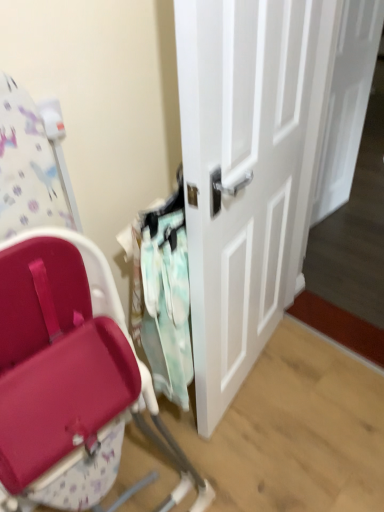
Where is `mint fabric laundry at center`? This screenshot has width=384, height=512. mint fabric laundry at center is located at coordinates (162, 294).

Where is `mint fabric laundry at center`? This screenshot has width=384, height=512. mint fabric laundry at center is located at coordinates (162, 294).

Can you confirm if white glossy door at center, arranged as the first door when viewed from the front, is shorter than mint fabric laundry at center?

Incorrect, the height of white glossy door at center, arranged as the first door when viewed from the front, does not fall short of that of mint fabric laundry at center.

Which object is positioned more to the left, white glossy door at center, arranged as the first door when viewed from the front, or mint fabric laundry at center?

mint fabric laundry at center is more to the left.

Is mint fabric laundry at center inside white glossy door at center, which ranks as the second door in right-to-left order?

Actually, mint fabric laundry at center is outside white glossy door at center, which ranks as the second door in right-to-left order.

Looking at this image, from a real-world perspective, is white glossy door at center, the second door positioned from the back, positioned above or below mint fabric laundry at center?

white glossy door at center, the second door positioned from the back, is above mint fabric laundry at center.

Considering the relative sizes of white glossy door at center, the second door positioned from the back, and white glossy door at center, which is the 1th door in right-to-left order, in the image provided, is white glossy door at center, the second door positioned from the back, taller than white glossy door at center, which is the 1th door in right-to-left order,?

Indeed, white glossy door at center, the second door positioned from the back, has a greater height compared to white glossy door at center, which is the 1th door in right-to-left order.

Would you say white glossy door at center, the second door positioned from the back, is inside or outside white glossy door at center, arranged as the 1th door when viewed from the back?

white glossy door at center, the second door positioned from the back, lies outside white glossy door at center, arranged as the 1th door when viewed from the back.

Based on the photo, considering the relative positions of white glossy door at center, which ranks as the second door in right-to-left order, and white glossy door at center, arranged as the 1th door when viewed from the back, in the image provided, is white glossy door at center, which ranks as the second door in right-to-left order, to the left of white glossy door at center, arranged as the 1th door when viewed from the back, from the viewer's perspective?

Indeed, white glossy door at center, which ranks as the second door in right-to-left order, is positioned on the left side of white glossy door at center, arranged as the 1th door when viewed from the back.

The height and width of the screenshot is (512, 384). I want to click on door to the left of white glossy door at center, the second door positioned from the front, so click(244, 175).

Looking at this image, considering the sizes of objects white glossy door at center, arranged as the 1th door when viewed from the back, and mint fabric laundry at center in the image provided, who is thinner, white glossy door at center, arranged as the 1th door when viewed from the back, or mint fabric laundry at center?

Thinner between the two is white glossy door at center, arranged as the 1th door when viewed from the back.

Is mint fabric laundry at center at the back of white glossy door at center, the second door positioned from the front?

No, white glossy door at center, the second door positioned from the front,'s orientation is not away from mint fabric laundry at center.

From a real-world perspective, who is located higher, white glossy door at center, arranged as the 2th door when viewed from the left, or mint fabric laundry at center?

From a 3D spatial view, mint fabric laundry at center is above.

How many degrees apart are the facing directions of white glossy door at center, arranged as the 2th door when viewed from the left, and mint fabric laundry at center?

The angular difference between white glossy door at center, arranged as the 2th door when viewed from the left, and mint fabric laundry at center is 16.3 degrees.

Is mint fabric laundry at center wider or thinner than white glossy door at center, arranged as the 2th door when viewed from the left?

Considering their sizes, mint fabric laundry at center looks broader than white glossy door at center, arranged as the 2th door when viewed from the left.

Based on the photo, is mint fabric laundry at center further to camera compared to white glossy door at center, arranged as the 2th door when viewed from the left?

No, mint fabric laundry at center is in front of white glossy door at center, arranged as the 2th door when viewed from the left.

From a real-world perspective, is mint fabric laundry at center under white glossy door at center, arranged as the 1th door when viewed from the back?

No, from a real-world perspective, mint fabric laundry at center is not under white glossy door at center, arranged as the 1th door when viewed from the back.

Looking at this image, from the image's perspective, is mint fabric laundry at center below white glossy door at center, arranged as the 1th door when viewed from the back?

Yes, from the image's perspective, mint fabric laundry at center is beneath white glossy door at center, arranged as the 1th door when viewed from the back.

Which of these two, mint fabric laundry at center or white glossy door at center, the second door positioned from the back, is bigger?

With larger size is white glossy door at center, the second door positioned from the back.

From the image's perspective, which one is positioned lower, mint fabric laundry at center or white glossy door at center, the second door positioned from the back?

mint fabric laundry at center, from the image's perspective.

Is mint fabric laundry at center beside white glossy door at center, arranged as the first door when viewed from the front?

mint fabric laundry at center and white glossy door at center, arranged as the first door when viewed from the front, are clearly separated.

Is the depth of mint fabric laundry at center greater than that of white glossy door at center, arranged as the first door when viewed from the front?

Yes, it is behind white glossy door at center, arranged as the first door when viewed from the front.

Consider the image. From a real-world perspective, is white glossy door at center, arranged as the 1th door when viewed from the back, physically above white glossy door at center, which ranks as the second door in right-to-left order?

Actually, white glossy door at center, arranged as the 1th door when viewed from the back, is physically below white glossy door at center, which ranks as the second door in right-to-left order, in the real world.

What's the angular difference between white glossy door at center, the second door positioned from the front, and white glossy door at center, the second door positioned from the back,'s facing directions?

There is a 15.9-degree angle between the facing directions of white glossy door at center, the second door positioned from the front, and white glossy door at center, the second door positioned from the back.

Which of these two, white glossy door at center, the second door positioned from the front, or white glossy door at center, which is the first door from left to right, is thinner?

Thinner between the two is white glossy door at center, the second door positioned from the front.

What are the coordinates of `door in front of the mint fabric laundry at center` in the screenshot? It's located at (244, 175).

Find the location of `door that appears on the left of white glossy door at center, which is the 1th door in right-to-left order`. door that appears on the left of white glossy door at center, which is the 1th door in right-to-left order is located at coordinates (244, 175).

Based on their spatial positions, is mint fabric laundry at center or white glossy door at center, which is the first door from left to right, closer to white glossy door at center, the second door positioned from the front?

white glossy door at center, which is the first door from left to right, is positioned closer to the anchor white glossy door at center, the second door positioned from the front.

When comparing their distances from mint fabric laundry at center, does white glossy door at center, which ranks as the second door in right-to-left order, or white glossy door at center, which is the 1th door in right-to-left order, seem further?

Among the two, white glossy door at center, which is the 1th door in right-to-left order, is located further to mint fabric laundry at center.

Estimate the real-world distances between objects in this image. Which object is further from white glossy door at center, the second door positioned from the back, white glossy door at center, which is the 1th door in right-to-left order, or mint fabric laundry at center?

Among the two, white glossy door at center, which is the 1th door in right-to-left order, is located further to white glossy door at center, the second door positioned from the back.

Looking at the image, which one is located closer to white glossy door at center, arranged as the 2th door when viewed from the left, white glossy door at center, the second door positioned from the back, or mint fabric laundry at center?

white glossy door at center, the second door positioned from the back.

Based on their spatial positions, is white glossy door at center, arranged as the 1th door when viewed from the back, or white glossy door at center, arranged as the first door when viewed from the front, closer to mint fabric laundry at center?

white glossy door at center, arranged as the first door when viewed from the front, is closer to mint fabric laundry at center.

Considering their positions, is mint fabric laundry at center positioned further to white glossy door at center, which ranks as the second door in right-to-left order, than white glossy door at center, arranged as the 2th door when viewed from the left?

white glossy door at center, arranged as the 2th door when viewed from the left, is positioned further to the anchor white glossy door at center, which ranks as the second door in right-to-left order.

Find the location of a particular element. This screenshot has width=384, height=512. laundry between white glossy door at center, which is the first door from left to right, and white glossy door at center, which is the 1th door in right-to-left order, from front to back is located at coordinates (162, 294).